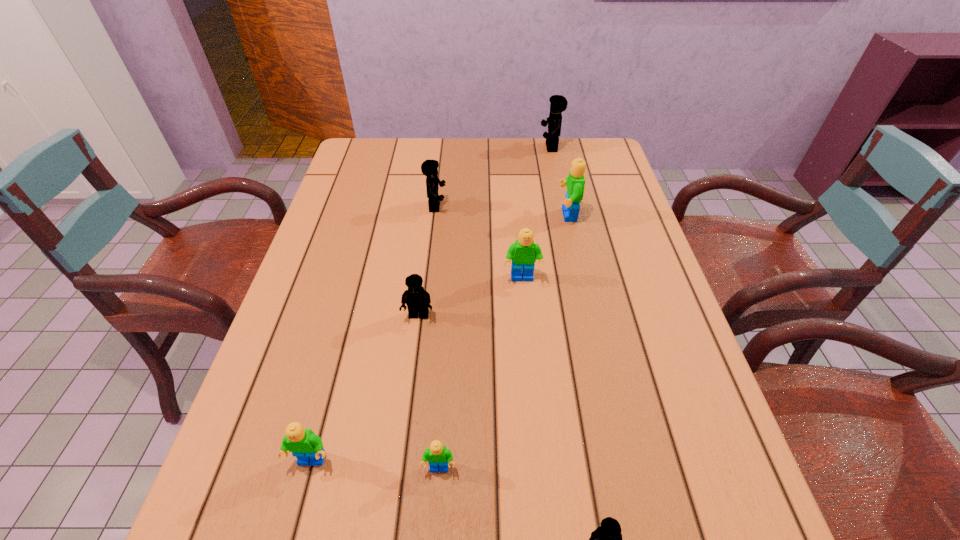
Where is `free space that is in between the second green Lego from left to right and the fourth nearest Lego`? The image size is (960, 540). free space that is in between the second green Lego from left to right and the fourth nearest Lego is located at coordinates (429, 392).

Where is `object that ranks as the fifth closest to the farthest green Lego`? This screenshot has width=960, height=540. object that ranks as the fifth closest to the farthest green Lego is located at coordinates (439, 458).

Where is `object that is the closest to the farthest object`? The width and height of the screenshot is (960, 540). object that is the closest to the farthest object is located at coordinates (575, 182).

Identify which Lego is located as the nearest to the smallest yellow Lego. Please provide its 2D coordinates. Your answer should be formatted as a tuple, i.e. [(x, y)], where the tuple contains the x and y coordinates of a point satisfying the conditions above.

[(439, 458)]

Locate which Lego ranks in proximity to the fourth nearest object. Please provide its 2D coordinates. Your answer should be formatted as a tuple, i.e. [(x, y)], where the tuple contains the x and y coordinates of a point satisfying the conditions above.

[(523, 253)]

Choose which yellow Lego is the third nearest neighbor to the smallest yellow Lego. Please provide its 2D coordinates. Your answer should be formatted as a tuple, i.e. [(x, y)], where the tuple contains the x and y coordinates of a point satisfying the conditions above.

[(558, 103)]

The image size is (960, 540). Identify the location of yellow Lego that is the second nearest to the second farthest yellow Lego. (558, 103).

Where is `green Lego that is the fourth closest one to the fifth farthest object`? The image size is (960, 540). green Lego that is the fourth closest one to the fifth farthest object is located at coordinates (575, 182).

Where is `green Lego that is the closest to the third smallest yellow Lego`? green Lego that is the closest to the third smallest yellow Lego is located at coordinates (523, 253).

Where is `vacant space that satisfies the following two spatial constraints: 1. on the face of the rightmost green Lego; 2. on the front-facing side of the fifth farthest object`? vacant space that satisfies the following two spatial constraints: 1. on the face of the rightmost green Lego; 2. on the front-facing side of the fifth farthest object is located at coordinates tap(589, 315).